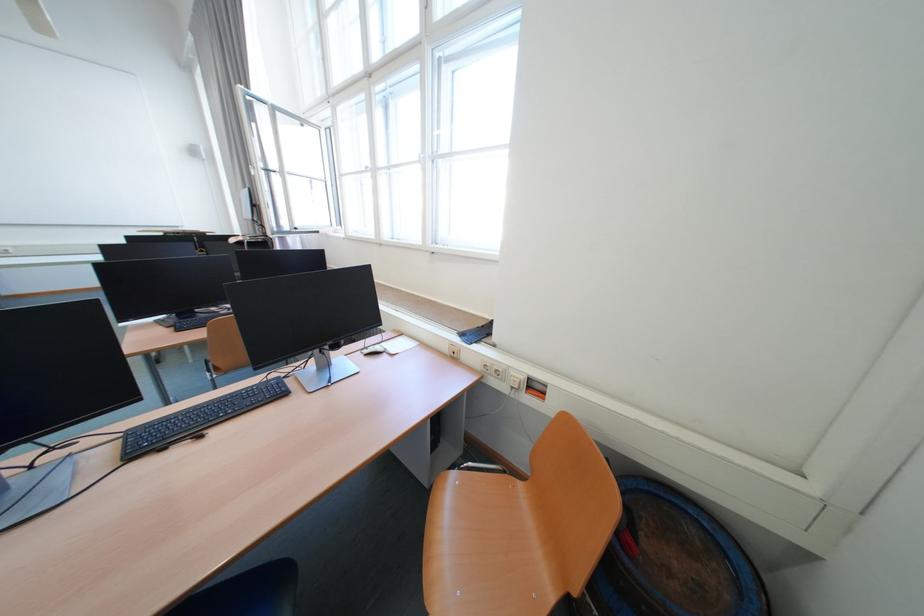
Identify the location of orange chair sitting surface. (482, 549).